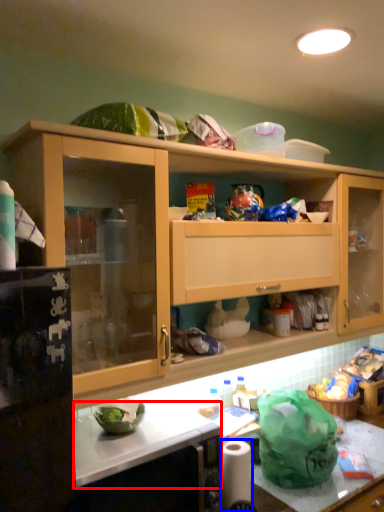
Question: Among these objects, which one is nearest to the camera, counter top (highlighted by a red box) or toilet paper (highlighted by a blue box)?

Choices:
 (A) counter top
 (B) toilet paper

Answer: (A)